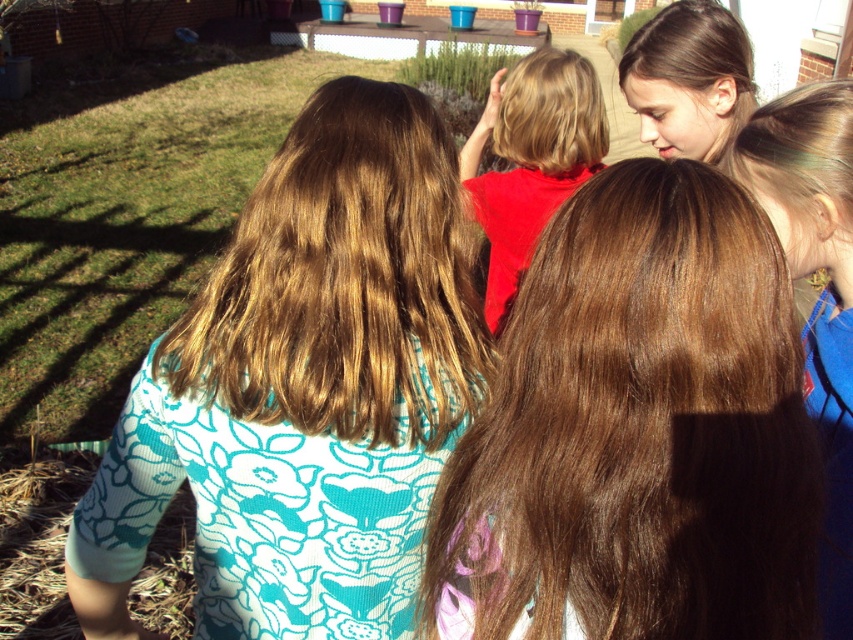
Question: From the image, what is the correct spatial relationship of brown hair at upper right in relation to brown hair at upper center?

Choices:
 (A) above
 (B) below

Answer: (B)

Question: Which object appears closest to the camera in this image?

Choices:
 (A) matte red shirt at center
 (B) brown wavy hair at center
 (C) brown hair at upper center
 (D) brown hair at upper right

Answer: (D)

Question: Can you confirm if matte red shirt at center is thinner than brown hair at upper center?

Choices:
 (A) no
 (B) yes

Answer: (A)

Question: Can you confirm if brown silky hair at center is wider than brown hair at upper right?

Choices:
 (A) yes
 (B) no

Answer: (A)

Question: Which of these objects is positioned farthest from the brown silky hair at center?

Choices:
 (A) brown wavy hair at center
 (B) brown hair at upper right
 (C) matte red shirt at center
 (D) brown hair at upper center

Answer: (C)

Question: Based on their relative distances, which object is nearer to the brown hair at upper center?

Choices:
 (A) brown silky hair at center
 (B) matte red shirt at center

Answer: (B)